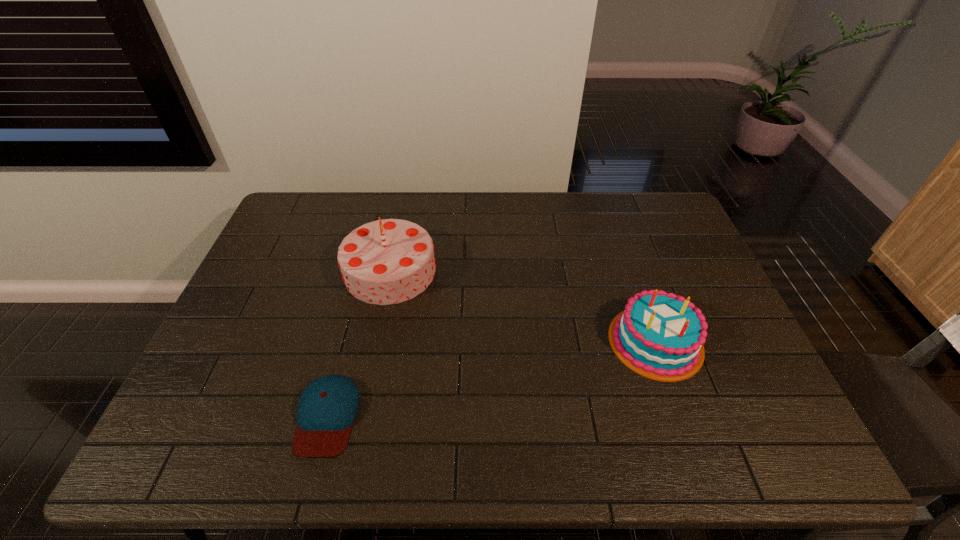
Image resolution: width=960 pixels, height=540 pixels. What are the coordinates of `empty location between the baseball cap and the rightmost object` in the screenshot? It's located at (492, 379).

Locate an element on the screen. free area in between the taller birthday cake and the baseball cap is located at coordinates (359, 343).

Identify the location of empty space that is in between the taller birthday cake and the rightmost object. (523, 306).

Find the location of `the closest object relative to the rightmost object`. the closest object relative to the rightmost object is located at coordinates (389, 261).

This screenshot has height=540, width=960. Find the location of `object that stands as the closest to the baseball cap`. object that stands as the closest to the baseball cap is located at coordinates (389, 261).